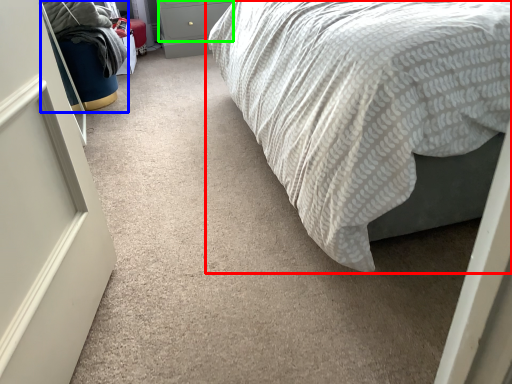
Question: Which is farther away from bed (highlighted by a red box)? bean bag chair (highlighted by a blue box) or drawer (highlighted by a green box)?

Choices:
 (A) bean bag chair
 (B) drawer

Answer: (B)